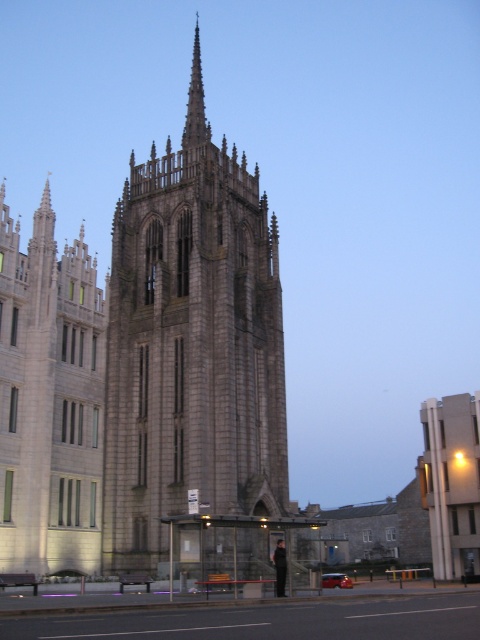
Does gray stone tower at center come behind gray stone spire at center?

No, gray stone tower at center is closer to the viewer.

Which is above, gray stone tower at center or gray stone spire at center?

gray stone spire at center is higher up.

Which is in front, point (142, 509) or point (203, 140)?

Point (142, 509)

Locate an element on the screen. The width and height of the screenshot is (480, 640). gray stone tower at center is located at coordinates (191, 353).

Based on the photo, is gray stone tower at center to the right of black leather jacket at center from the viewer's perspective?

Incorrect, gray stone tower at center is not on the right side of black leather jacket at center.

Between point (109, 330) and point (276, 545), which one is positioned behind?

Point (109, 330)

You are a GUI agent. You are given a task and a screenshot of the screen. Output one action in this format:
    pyautogui.click(x=<x>, y=<y>)
    Task: Click on the gray stone tower at center
    The width and height of the screenshot is (480, 640).
    Given the screenshot: What is the action you would take?
    pyautogui.click(x=191, y=353)

Can you confirm if gray stone spire at center is taller than black leather jacket at center?

Indeed, gray stone spire at center has a greater height compared to black leather jacket at center.

Which is behind, point (188, 145) or point (276, 545)?

Point (188, 145)

Identify the location of gray stone spire at center. This screenshot has height=640, width=480. (195, 100).